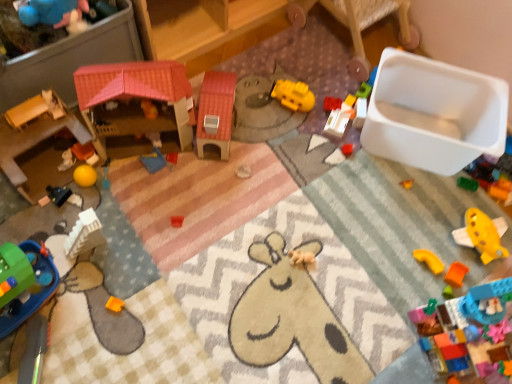
Image resolution: width=512 pixels, height=384 pixels. Identify the location of free location to the right of green plastic toy at lower left, acting as the second toy starting from the left. (94, 305).